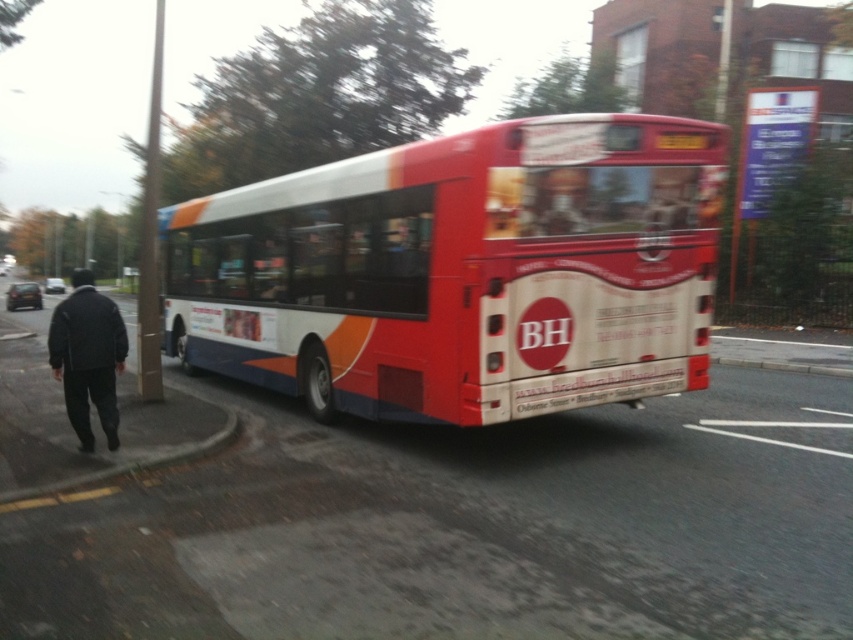
Does red matte bus at center have a lesser height compared to dark gray jacket at left?

Correct, red matte bus at center is not as tall as dark gray jacket at left.

Does red matte bus at center lie behind dark gray jacket at left?

No.

Which is behind, point (386, 224) or point (67, 392)?

The point (386, 224) is more distant.

At what (x,y) coordinates should I click in order to perform the action: click on red matte bus at center. Please return your answer as a coordinate pair (x, y). Looking at the image, I should click on (462, 272).